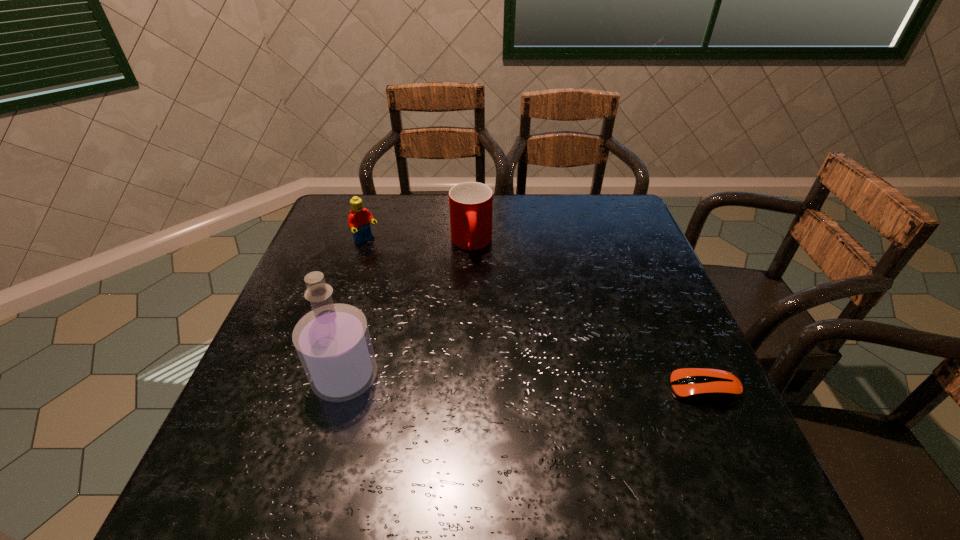
Where is `free area in between the tallest object and the shortest object`? free area in between the tallest object and the shortest object is located at coordinates (525, 383).

Locate an element on the screen. The width and height of the screenshot is (960, 540). blank region between the cup and the perfume is located at coordinates (408, 310).

You are a GUI agent. You are given a task and a screenshot of the screen. Output one action in this format:
    pyautogui.click(x=<x>, y=<y>)
    Task: Click on the free space between the Lego and the cup
    Image resolution: width=960 pixels, height=540 pixels.
    Given the screenshot: What is the action you would take?
    pyautogui.click(x=419, y=242)

Locate an element on the screen. This screenshot has width=960, height=540. blank region between the shortest object and the second object from right to left is located at coordinates (588, 316).

Locate an element on the screen. vacant region between the cup and the Lego is located at coordinates (419, 242).

The height and width of the screenshot is (540, 960). Find the location of `empty space that is in between the third object from left to right and the Lego`. empty space that is in between the third object from left to right and the Lego is located at coordinates (419, 242).

The image size is (960, 540). Find the location of `free space between the cup and the Lego`. free space between the cup and the Lego is located at coordinates (419, 242).

Locate an element on the screen. Image resolution: width=960 pixels, height=540 pixels. the closest object to the Lego is located at coordinates (470, 203).

Identify which object is the third closest to the perfume. Please provide its 2D coordinates. Your answer should be formatted as a tuple, i.e. [(x, y)], where the tuple contains the x and y coordinates of a point satisfying the conditions above.

[(705, 385)]

Find the location of `vacant position in the image that satisfies the following two spatial constraints: 1. on the back side of the perfume; 2. on the left side of the cup`. vacant position in the image that satisfies the following two spatial constraints: 1. on the back side of the perfume; 2. on the left side of the cup is located at coordinates (383, 244).